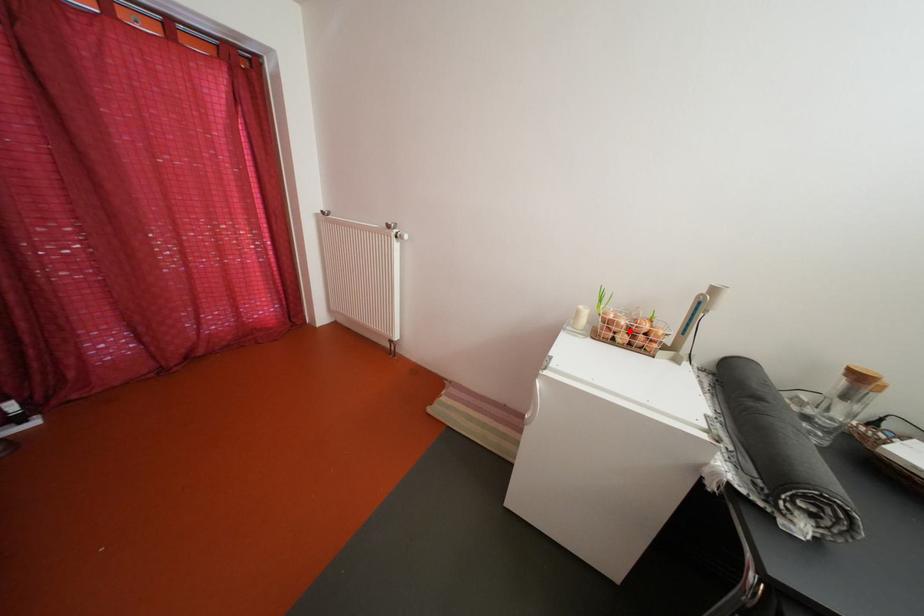
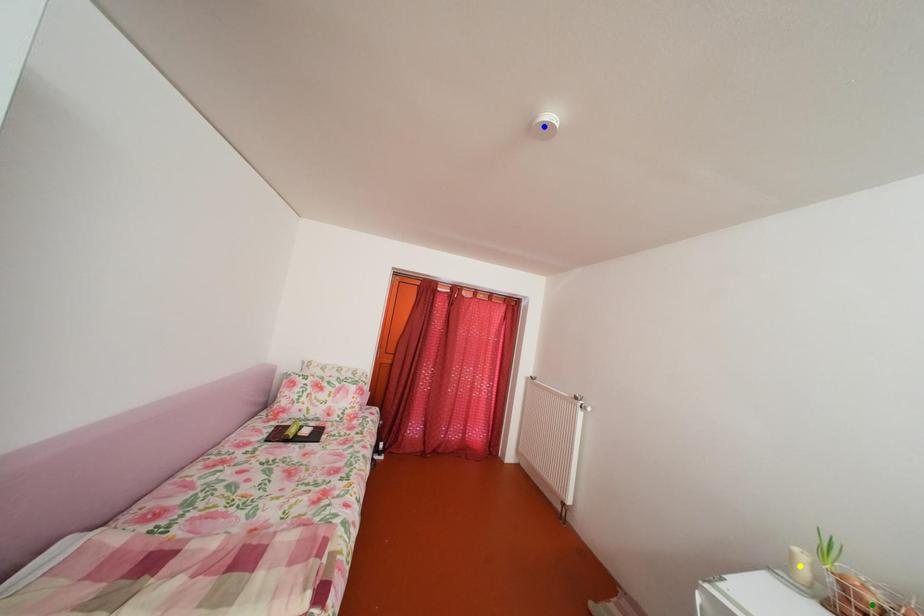
Question: I am providing you with two images of the same scene from different viewpoints. A red point is marked on the first image. You are given multiple points on the second image. Which spot in image 2 lines up with the point in image 1?

Choices:
 (A) green point
 (B) yellow point
 (C) blue point

Answer: (A)